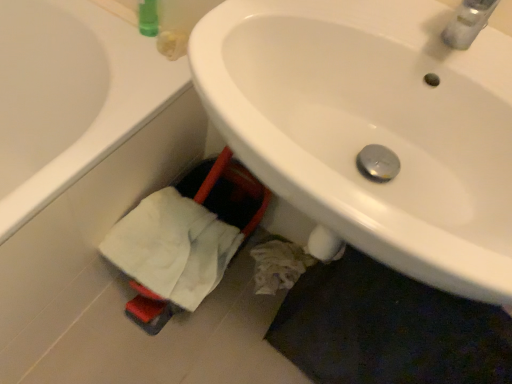
Question: From a real-world perspective, does white glossy sink at center sit lower than white matte bathtub at lower left?

Choices:
 (A) no
 (B) yes

Answer: (A)

Question: Does white glossy sink at center have a greater height compared to white matte bathtub at lower left?

Choices:
 (A) yes
 (B) no

Answer: (A)

Question: Is white glossy sink at center thinner than white matte bathtub at lower left?

Choices:
 (A) yes
 (B) no

Answer: (A)

Question: Is white glossy sink at center at the left side of white matte bathtub at lower left?

Choices:
 (A) no
 (B) yes

Answer: (A)

Question: From a real-world perspective, is white glossy sink at center located higher than white matte bathtub at lower left?

Choices:
 (A) yes
 (B) no

Answer: (A)

Question: From the image's perspective, is white glossy sink at center located beneath white matte bathtub at lower left?

Choices:
 (A) yes
 (B) no

Answer: (A)

Question: Can you confirm if white glossy sink at center is positioned to the left of white cotton bath towel at lower left?

Choices:
 (A) no
 (B) yes

Answer: (A)

Question: Can you confirm if white glossy sink at center is wider than white cotton bath towel at lower left?

Choices:
 (A) no
 (B) yes

Answer: (B)

Question: Can you confirm if white glossy sink at center is shorter than white cotton bath towel at lower left?

Choices:
 (A) no
 (B) yes

Answer: (A)

Question: From the image's perspective, is white glossy sink at center located above white cotton bath towel at lower left?

Choices:
 (A) yes
 (B) no

Answer: (A)

Question: From a real-world perspective, does white glossy sink at center sit lower than white cotton bath towel at lower left?

Choices:
 (A) yes
 (B) no

Answer: (B)

Question: Is white glossy sink at center positioned with its back to white cotton bath towel at lower left?

Choices:
 (A) yes
 (B) no

Answer: (B)

Question: Would you say white cotton bath towel at lower left is outside white matte bathtub at lower left?

Choices:
 (A) yes
 (B) no

Answer: (A)